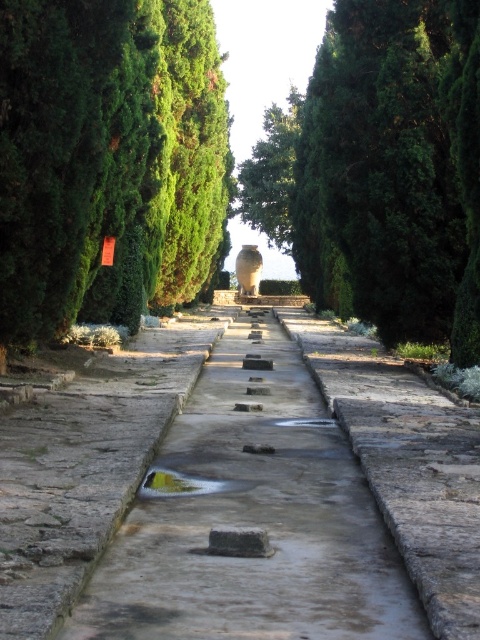
You are a gardener planning to place a decorative statue exactly in the middle of the pathway. The statue requires a base that must be wider than the gray stone steps at center but narrower than the green textured stone at center. Can you fit such a base between them?

The gray stone steps at center has a lesser width compared to green textured stone at center, so yes, a base wider than the gray stone steps at center but narrower than the green textured stone at center can fit between them.

You are standing at the entrance of the pathway and see two points marked on the ground. The first is at point (151, 220) and the second is at point (313, 593). Which point is closer to you?

Point (151, 220) is closer to you because it is further to the camera than point (313, 593).